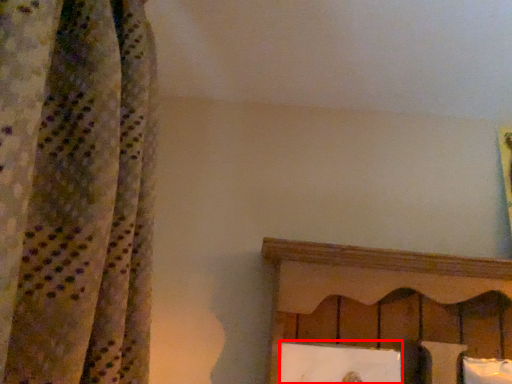
Question: In this image, where is picture frame (annotated by the red box) located relative to pillow?

Choices:
 (A) right
 (B) left

Answer: (B)